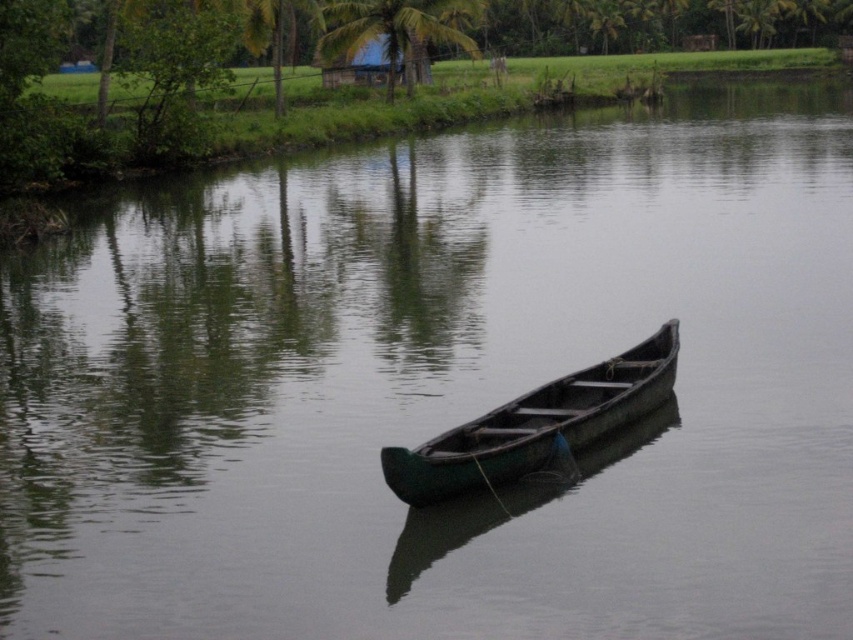
You are standing on the dock and see the green wooden canoe at center and the green leafy palm tree at upper center. Which object is closer to you?

The green wooden canoe at center is closer to you because it is in front of the green leafy palm tree at upper center.